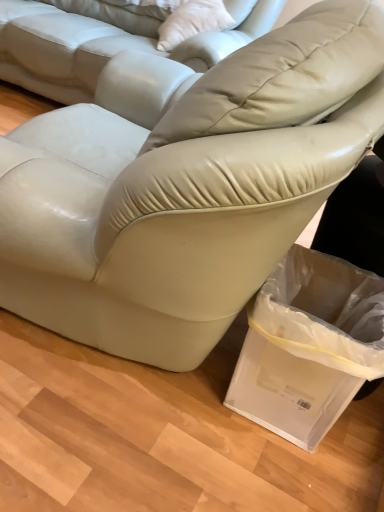
The image size is (384, 512). In order to click on vacant space to the left of clear plastic bag at lower right in this screenshot , I will do `click(193, 421)`.